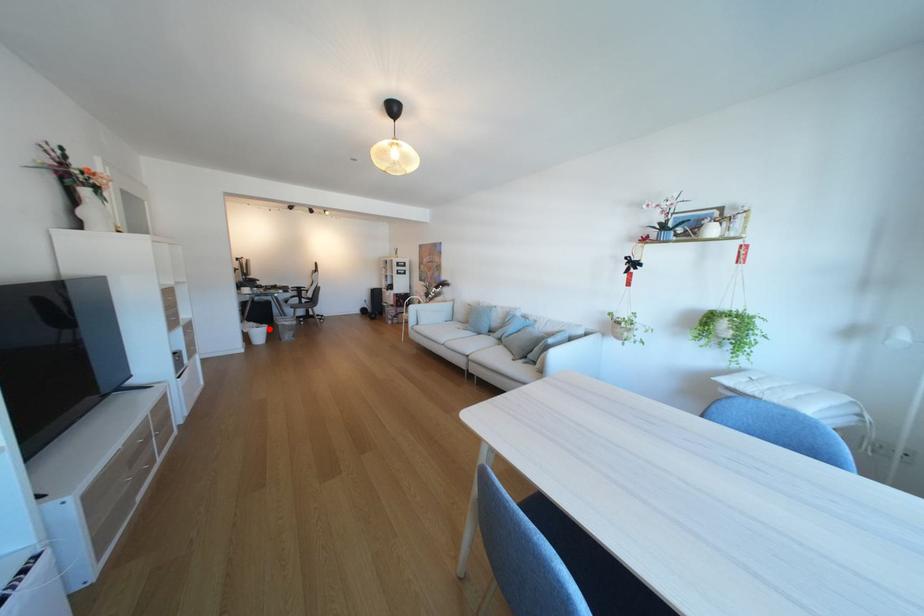
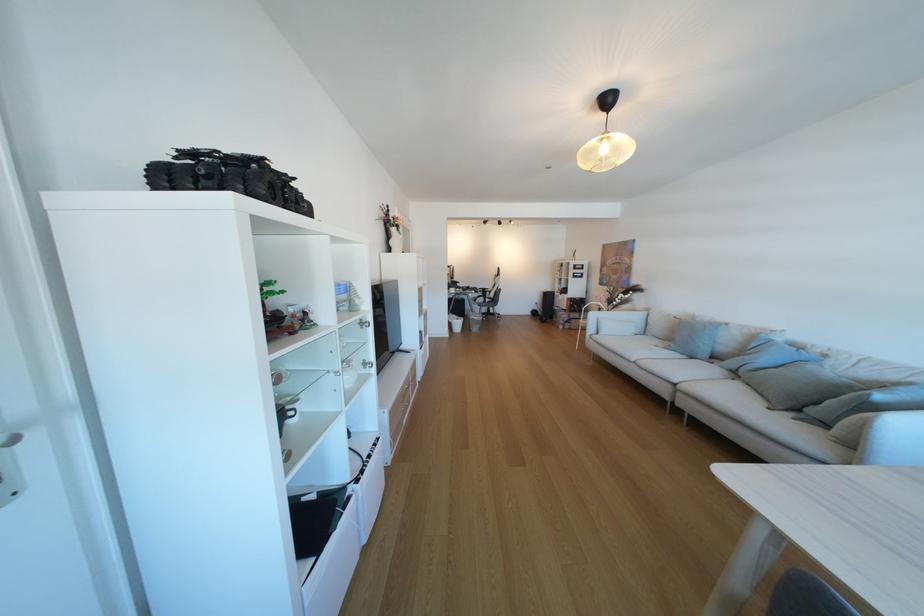
Question: A red point is marked in image1. In image2, is the corresponding 3D point closer to the camera or farther? Reply with the corresponding letter.

Choices:
 (A) The corresponding 3D point is closer.
 (B) The corresponding 3D point is farther.

Answer: (B)